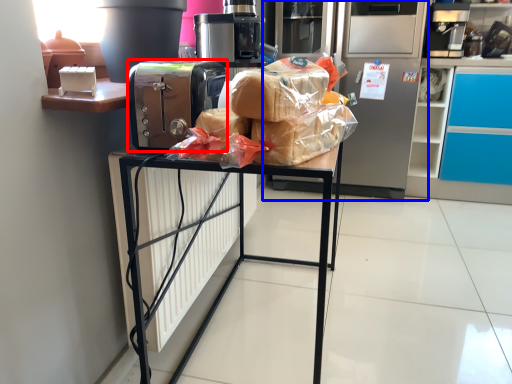
Question: Which object appears farthest to the camera in this image, home appliance (highlighted by a red box) or appliance (highlighted by a blue box)?

Choices:
 (A) home appliance
 (B) appliance

Answer: (B)